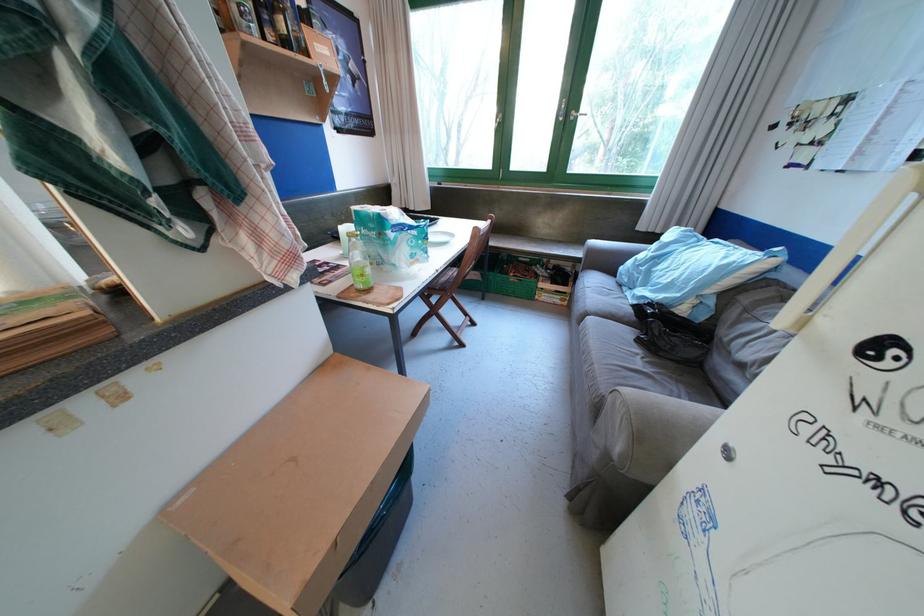
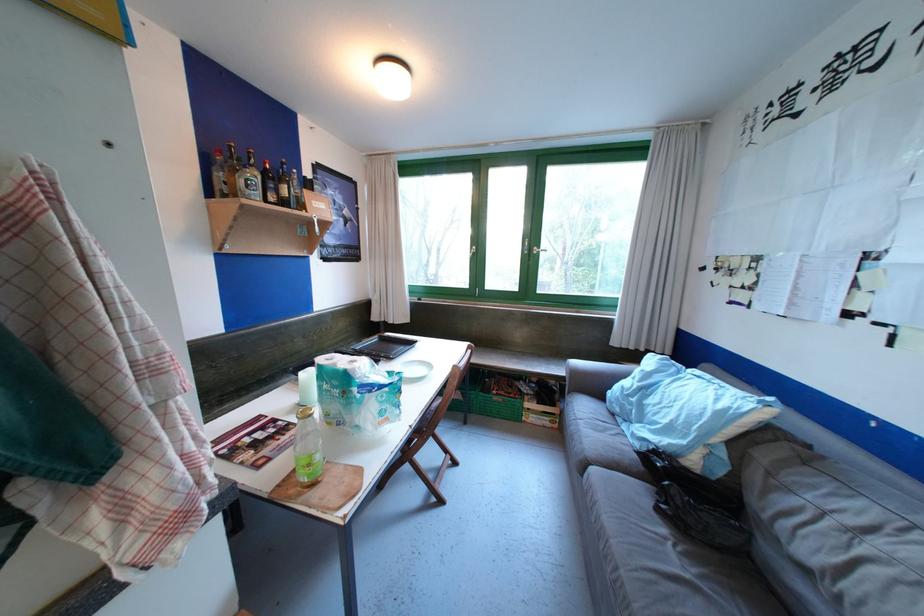
Where in the second image is the point corresponding to (599,254) from the first image?

(581, 376)